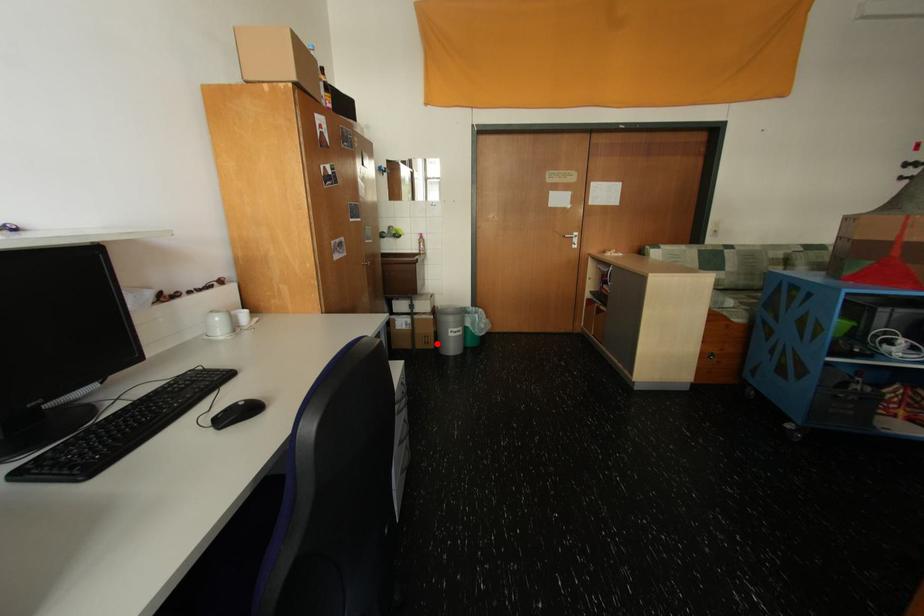
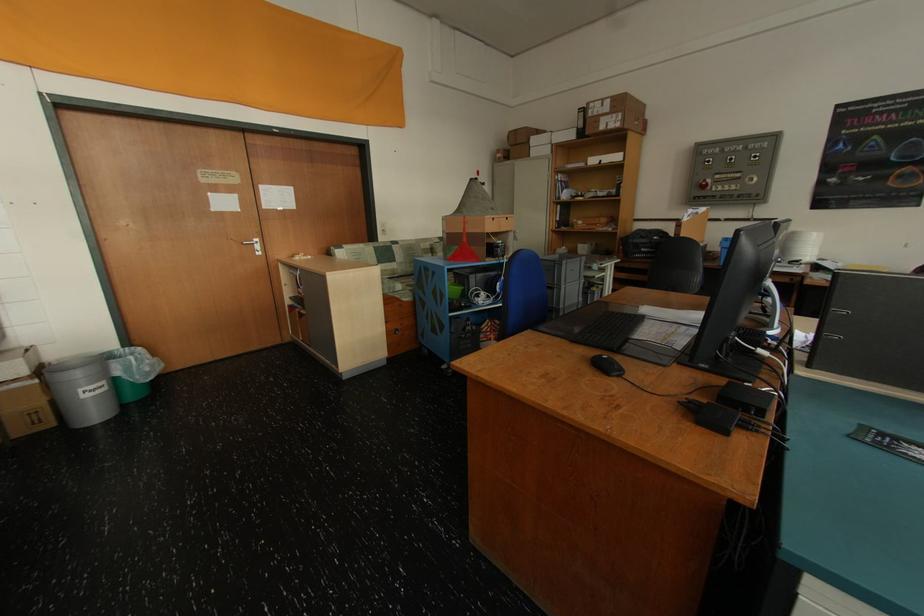
Question: I am providing you with two images of the same scene from different viewpoints. A red point is shown in image1. For the corresponding object point in image2, is it positioned nearer or farther from the camera?

Choices:
 (A) Nearer
 (B) Farther

Answer: (B)